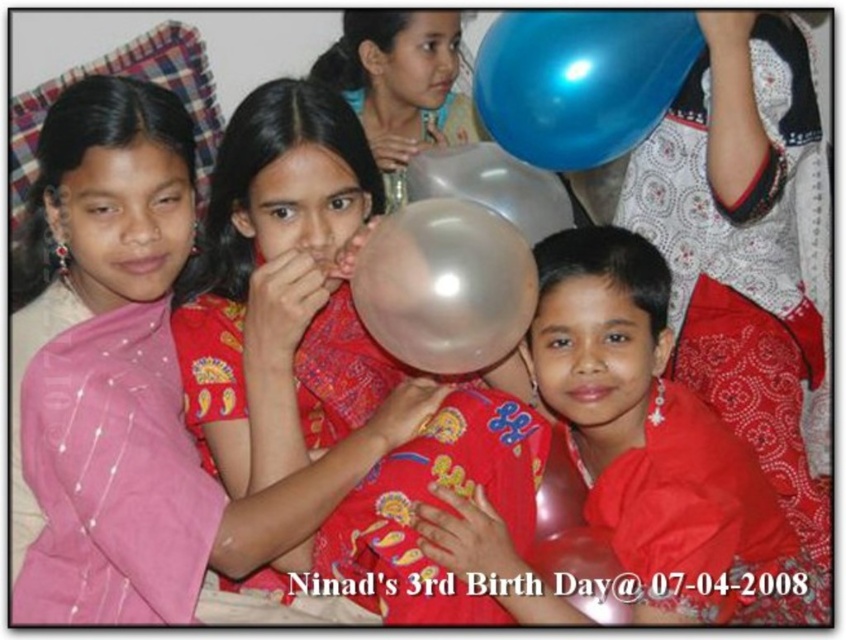
Between shiny red balloon at center and transparent plastic balloon at center, which one is positioned lower?

shiny red balloon at center is below.

Who is positioned more to the right, shiny red balloon at center or transparent plastic balloon at center?

Positioned to the right is shiny red balloon at center.

Who is more distant from viewer, (616, 388) or (482, 228)?

The point (616, 388) is behind.

Locate an element on the screen. shiny red balloon at center is located at coordinates (656, 442).

Which is above, translucent plastic balloon at center or shiny red balloon at center?

translucent plastic balloon at center is above.

What do you see at coordinates (279, 289) in the screenshot? This screenshot has height=640, width=846. I see `translucent plastic balloon at center` at bounding box center [279, 289].

Locate an element on the screen. Image resolution: width=846 pixels, height=640 pixels. translucent plastic balloon at center is located at coordinates (279, 289).

Which is behind, point (628, 454) or point (607, 70)?

The point (607, 70) is behind.

Does point (722, 490) lie behind point (658, 113)?

No.

Where is `shiny red balloon at center`? shiny red balloon at center is located at coordinates point(656,442).